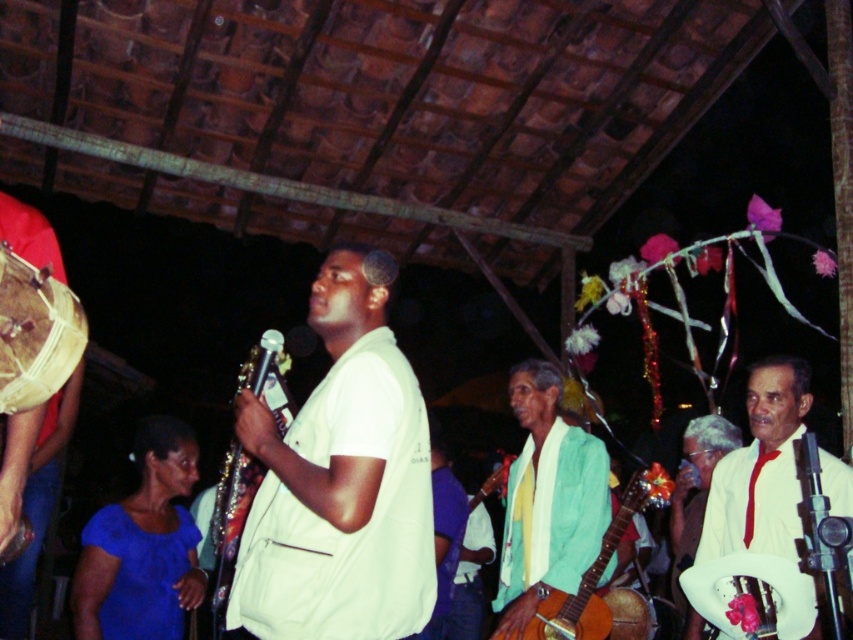
Is white matte shirt at center above wooden drum at left?

Indeed, white matte shirt at center is positioned over wooden drum at left.

Where is `white matte shirt at center`? The image size is (853, 640). white matte shirt at center is located at coordinates (341, 481).

Based on the photo, who is shorter, white satin hat at right or natural wood drum at left?

natural wood drum at left

Which is more to the right, white satin hat at right or natural wood drum at left?

white satin hat at right is more to the right.

Which is behind, point (738, 532) or point (38, 380)?

The point (738, 532) is behind.

Locate an element on the screen. white satin hat at right is located at coordinates (759, 468).

Between point (55, 477) and point (743, 556), which one is positioned behind?

Point (55, 477)

Is wooden drum at left taller than white fabric drum at lower right?

Yes, wooden drum at left is taller than white fabric drum at lower right.

Is point (44, 436) positioned in front of point (730, 602)?

Yes, it is in front of point (730, 602).

Identify the location of wooden drum at left. The image size is (853, 640). (38, 506).